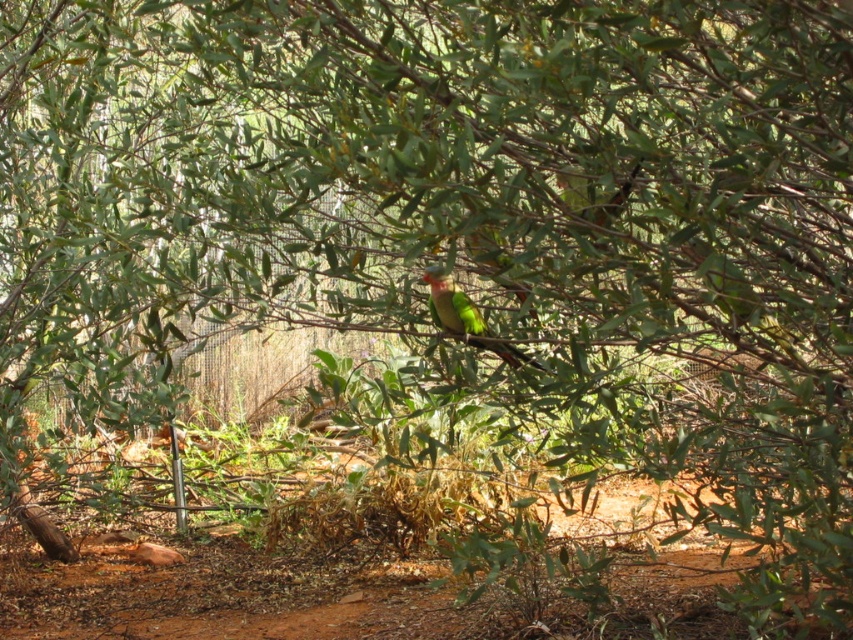
This screenshot has height=640, width=853. I want to click on dirt field at lower center, so click(x=343, y=596).

Is dirt field at lower center smaller than green matte parrot at center?

No, dirt field at lower center is not smaller than green matte parrot at center.

Identify the location of dirt field at lower center. (343, 596).